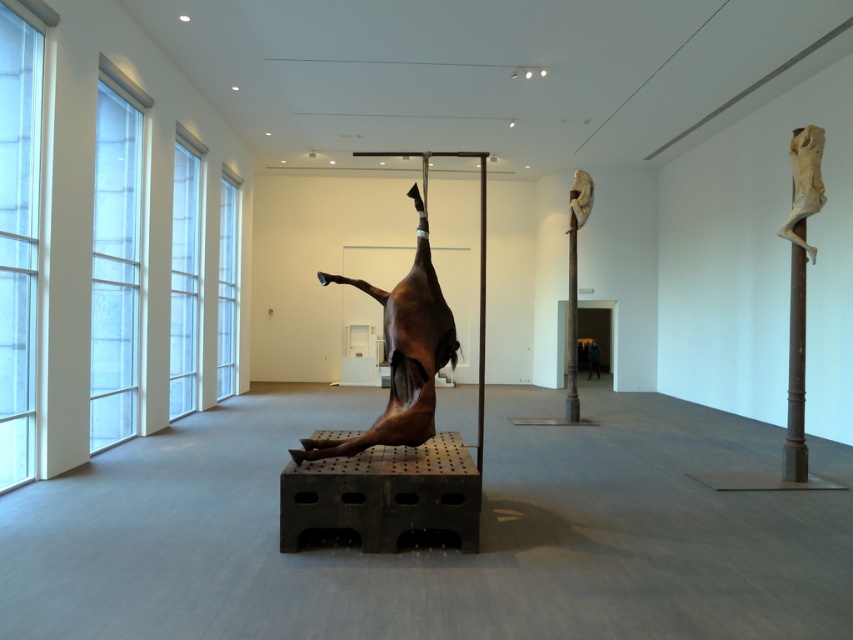
You are an art curator planning to install a new sculpture in the gallery. The sculpture requires a space that is taller than the dark blue jacket at center. Can the matte white figure at right provide enough height for this requirement?

The matte white figure at right is much taller than the dark blue jacket at center, so it can provide sufficient height for the new sculpture.

You are an art critic visiting the gallery and want to take a photo of both the matte white figure at right and the dark blue jacket at center. Since you can only focus on one object at a time, which one should you focus on first to ensure the other remains in the background?

You should focus on the matte white figure at right first because it is closer to the viewer than the dark blue jacket at center, so if you focus on the closer object, the farther one will stay in the background.

You are standing at the entrance of the art gallery and want to get to the point marked as point (345, 451). If your walking speed is 1.2 meters per second, how many seconds will it take you to reach that point?

The distance between you and point (345, 451) is 4.56 meters. At a speed of 1.2 meters per second, it will take you 4.56 divided by 1.2, which is approximately 3.8 seconds to reach the point.